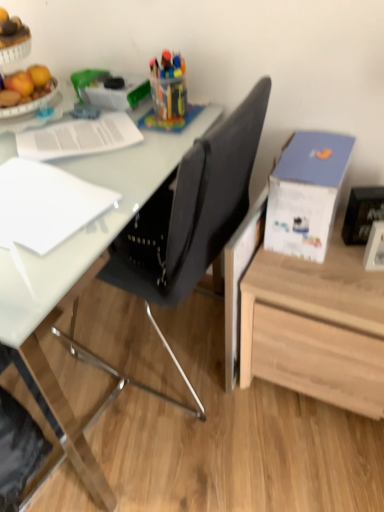
Where is `empty space that is ontop of blue cardboard box at upper right (from a real-world perspective)`? The height and width of the screenshot is (512, 384). empty space that is ontop of blue cardboard box at upper right (from a real-world perspective) is located at coordinates (311, 159).